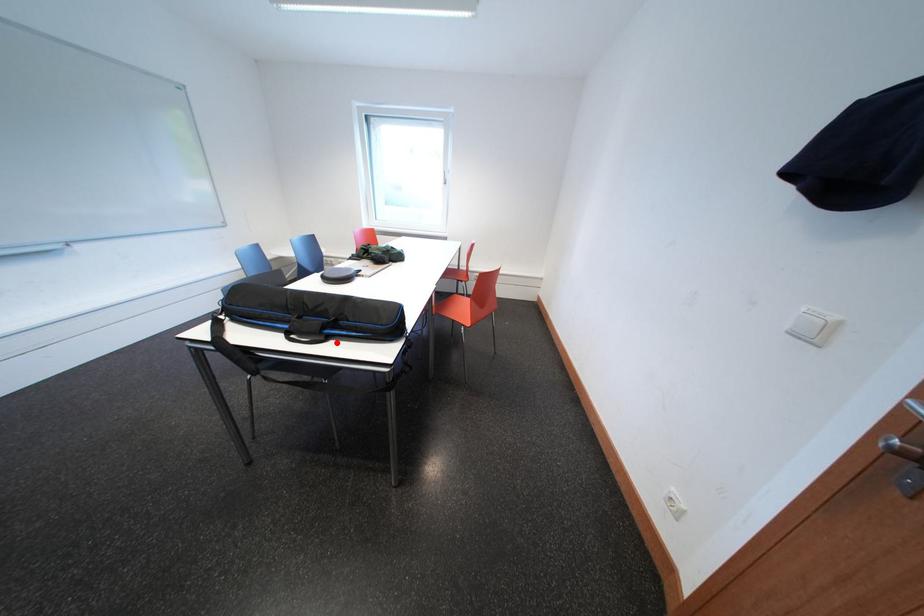
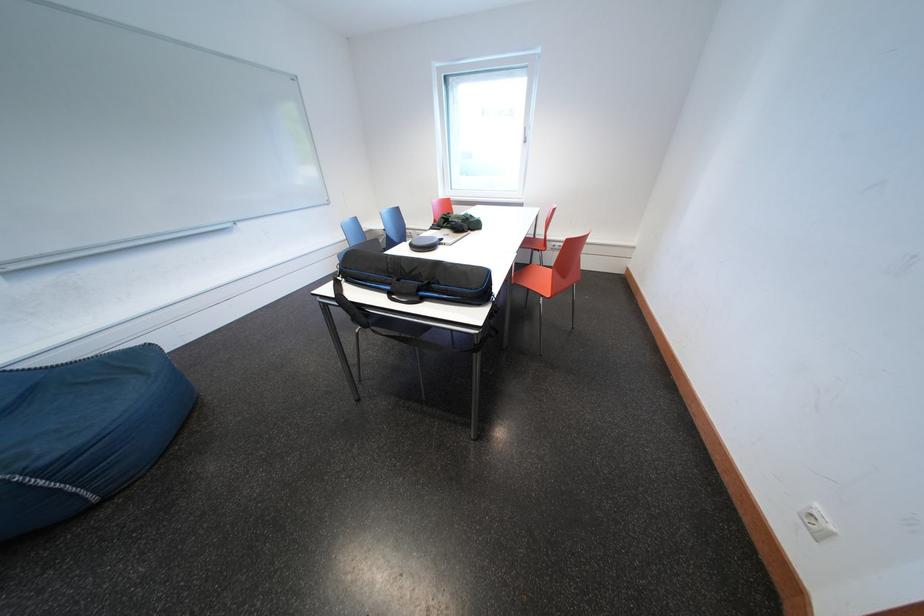
Question: I am providing you with two images of the same scene from different viewpoints. A red point is marked on the first image. Can you still see the location of the red point in image 2?

Choices:
 (A) Yes
 (B) No

Answer: (A)